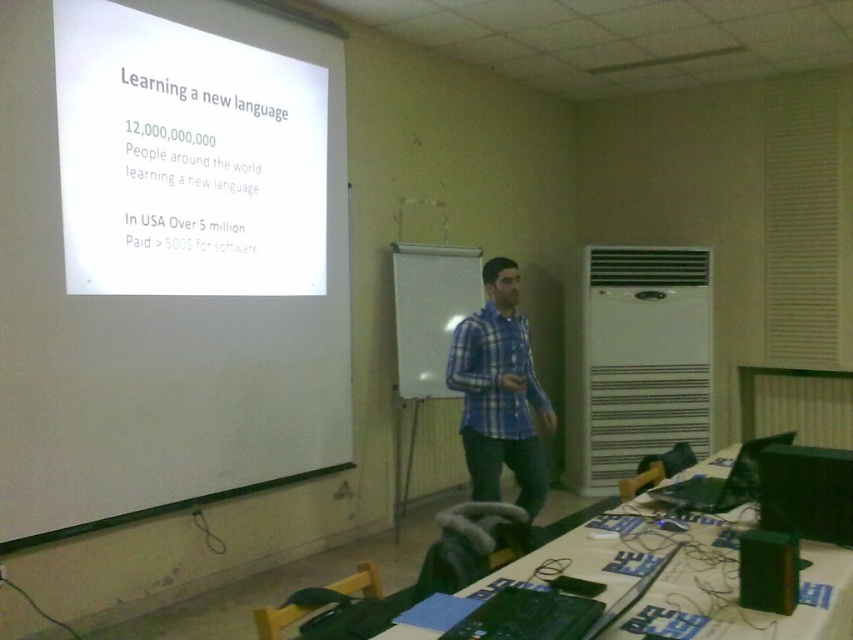
Who is more forward, (408, 625) or (428, 355)?

Point (408, 625) is more forward.

Does green fabric table at lower right have a smaller size compared to whiteboard at center?

Indeed, green fabric table at lower right has a smaller size compared to whiteboard at center.

You are a GUI agent. You are given a task and a screenshot of the screen. Output one action in this format:
    pyautogui.click(x=<x>, y=<y>)
    Task: Click on the green fabric table at lower right
    The image size is (853, 640).
    Given the screenshot: What is the action you would take?
    tap(685, 577)

Between white paper at upper left and blue plaid shirt at center, which one appears on the left side from the viewer's perspective?

From the viewer's perspective, white paper at upper left appears more on the left side.

Is point (128, 204) positioned in front of point (469, 365)?

Yes, point (128, 204) is in front of point (469, 365).

Consider the image. Measure the distance between point (238, 225) and camera.

Point (238, 225) and camera are 12.15 feet apart.

At what (x,y) coordinates should I click in order to perform the action: click on white paper at upper left. Please return your answer as a coordinate pair (x, y). The width and height of the screenshot is (853, 640). Looking at the image, I should click on (186, 157).

Does white matte projection screen at upper left have a lesser height compared to white paper at upper left?

No, white matte projection screen at upper left is not shorter than white paper at upper left.

Between white matte projection screen at upper left and white paper at upper left, which one appears on the right side from the viewer's perspective?

white paper at upper left is more to the right.

Which is behind, point (276, 289) or point (177, 33)?

Positioned behind is point (276, 289).

The image size is (853, 640). I want to click on white matte projection screen at upper left, so click(x=166, y=257).